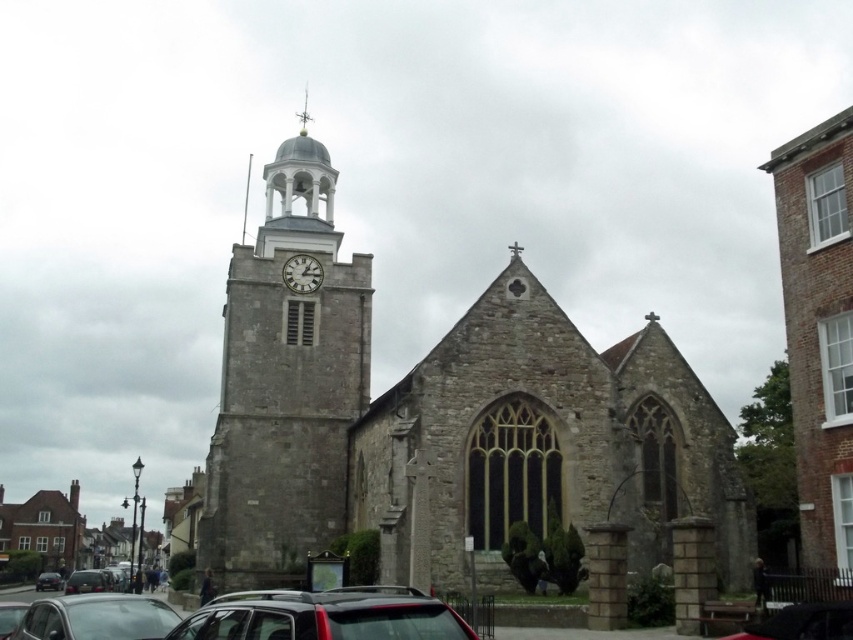
Is metallic silver car at lower left to the left of white stone clock at center from the viewer's perspective?

Correct, you'll find metallic silver car at lower left to the left of white stone clock at center.

Does metallic silver car at lower left come in front of white stone clock at center?

That is True.

Is point (136, 634) positioned before point (283, 280)?

Yes, point (136, 634) is closer to viewer.

Find the location of a particular element. metallic silver car at lower left is located at coordinates (97, 618).

Is stone clock tower at center-left shorter than white stone clock at center?

No, stone clock tower at center-left is not shorter than white stone clock at center.

Is stone clock tower at center-left to the left of white stone clock at center from the viewer's perspective?

Yes, stone clock tower at center-left is to the left of white stone clock at center.

Which is in front, point (321, 364) or point (312, 268)?

Positioned in front is point (321, 364).

The image size is (853, 640). I want to click on stone clock tower at center-left, so click(285, 385).

Can you confirm if brown brick church at right is thinner than shiny silver car at lower left?

In fact, brown brick church at right might be wider than shiny silver car at lower left.

Does brown brick church at right lie in front of shiny silver car at lower left?

Yes, it is in front of shiny silver car at lower left.

Between point (834, 285) and point (73, 586), which one is positioned in front?

Positioned in front is point (834, 285).

Locate an element on the screen. brown brick church at right is located at coordinates (819, 337).